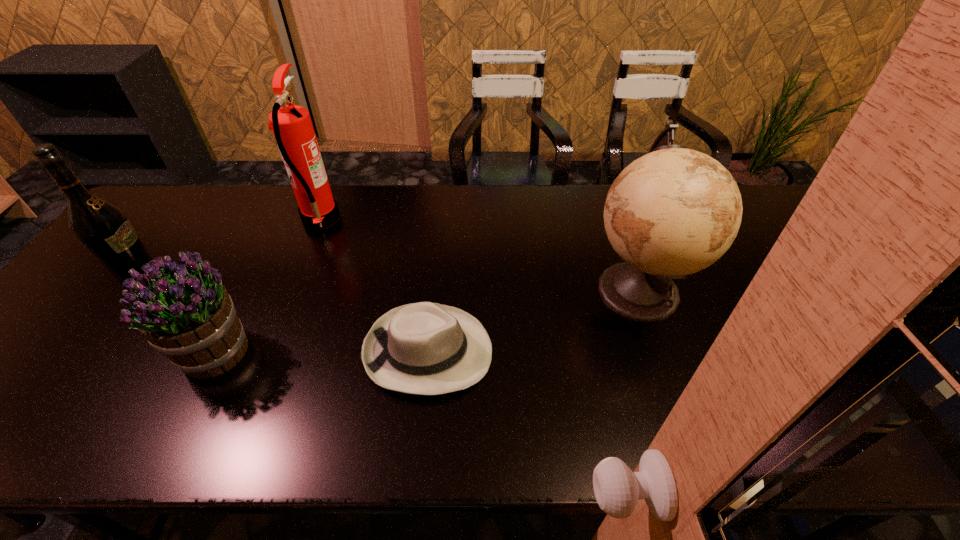
Identify the location of blank area located on the label of the leftmost object. This screenshot has height=540, width=960. (220, 274).

At what (x,y) coordinates should I click in order to perform the action: click on vacant region located 0.230m on the back of the bouquet. Please return your answer as a coordinate pair (x, y). This screenshot has width=960, height=540. Looking at the image, I should click on (263, 258).

The width and height of the screenshot is (960, 540). I want to click on free space located on the front-facing side of the fedora, so click(652, 352).

The width and height of the screenshot is (960, 540). Identify the location of object located at the far edge. (291, 124).

Find the location of a particular element. object that is at the left edge is located at coordinates (101, 226).

Locate an element on the screen. The height and width of the screenshot is (540, 960). free region at the far edge of the desktop is located at coordinates (563, 203).

This screenshot has width=960, height=540. What are the coordinates of `vacant space at the near edge` in the screenshot? It's located at (289, 430).

Find the location of `vacant space at the left edge`. vacant space at the left edge is located at coordinates (66, 329).

At what (x,y) coordinates should I click in order to perform the action: click on free region at the near left corner. Please return your answer as a coordinate pair (x, y). Looking at the image, I should click on (7, 410).

Locate an element on the screen. Image resolution: width=960 pixels, height=540 pixels. free area in between the farthest object and the globe is located at coordinates pyautogui.click(x=479, y=254).